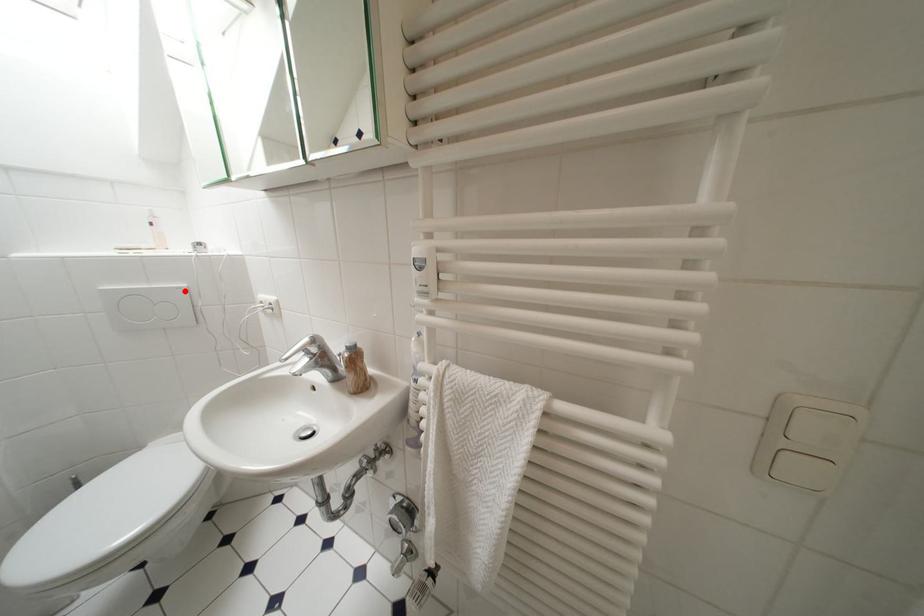
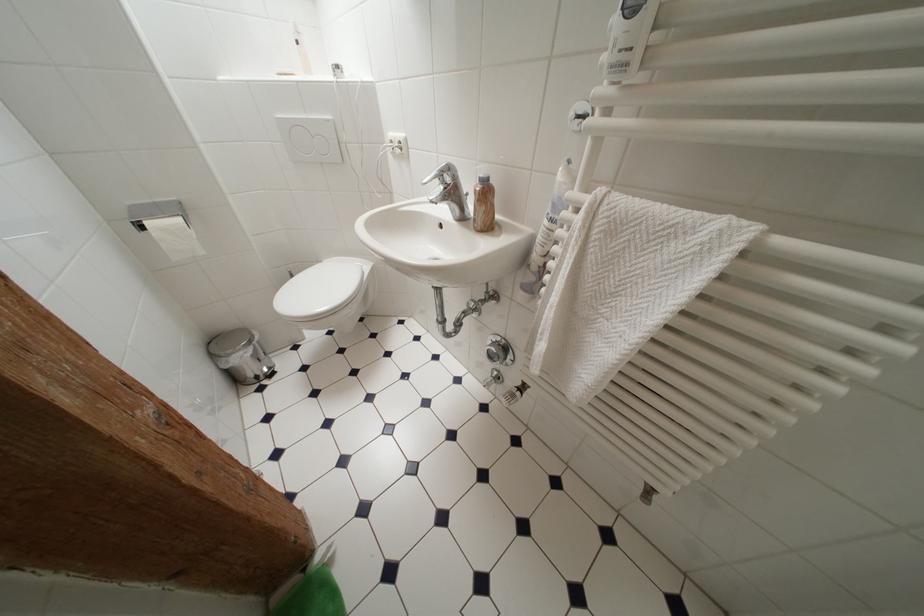
Locate, in the second image, the point that corresponds to the highlighted location in the first image.

(333, 124)